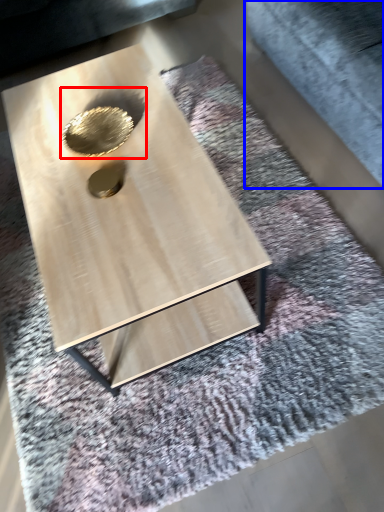
Question: Among these objects, which one is farthest to the camera, hole (highlighted by a red box) or gray (highlighted by a blue box)?

Choices:
 (A) hole
 (B) gray

Answer: (A)